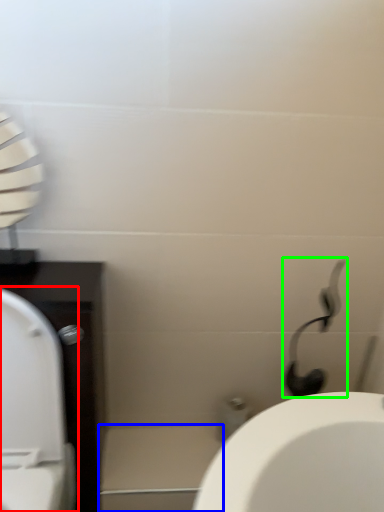
Question: Which object is the farthest from toilet (highlighted by a red box)? Choose among these: porcelain (highlighted by a blue box) or shower (highlighted by a green box).

Choices:
 (A) porcelain
 (B) shower

Answer: (B)